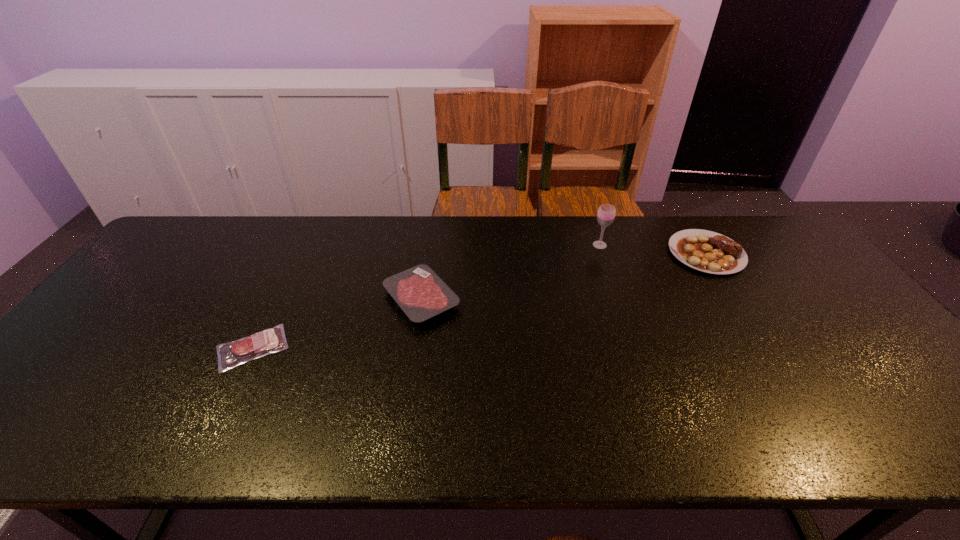
I want to click on blank region between the tallest steak and the second object from right to left, so click(x=653, y=249).

Where is `empty space that is in between the tallest steak and the second shortest object`? The height and width of the screenshot is (540, 960). empty space that is in between the tallest steak and the second shortest object is located at coordinates (564, 276).

This screenshot has height=540, width=960. I want to click on vacant region between the tallest object and the tallest steak, so click(653, 249).

This screenshot has width=960, height=540. What are the coordinates of `vacant space that's between the leftmost steak and the rightmost steak` in the screenshot? It's located at (479, 300).

Where is `unoccupied position between the third shortest object and the third object from left to right`? unoccupied position between the third shortest object and the third object from left to right is located at coordinates (653, 249).

Where is `vacant space that is in between the wineglass and the second tallest steak`? The height and width of the screenshot is (540, 960). vacant space that is in between the wineglass and the second tallest steak is located at coordinates (511, 272).

Locate an element on the screen. vacant space that's between the tallest steak and the tallest object is located at coordinates (653, 249).

Image resolution: width=960 pixels, height=540 pixels. In order to click on free space between the second steak from right to left and the rightmost steak in this screenshot , I will do `click(564, 276)`.

Where is `object that stands as the second closest to the tallest steak`? The image size is (960, 540). object that stands as the second closest to the tallest steak is located at coordinates (419, 291).

Select which object appears as the third closest to the shortest steak. Please provide its 2D coordinates. Your answer should be formatted as a tuple, i.e. [(x, y)], where the tuple contains the x and y coordinates of a point satisfying the conditions above.

[(703, 250)]